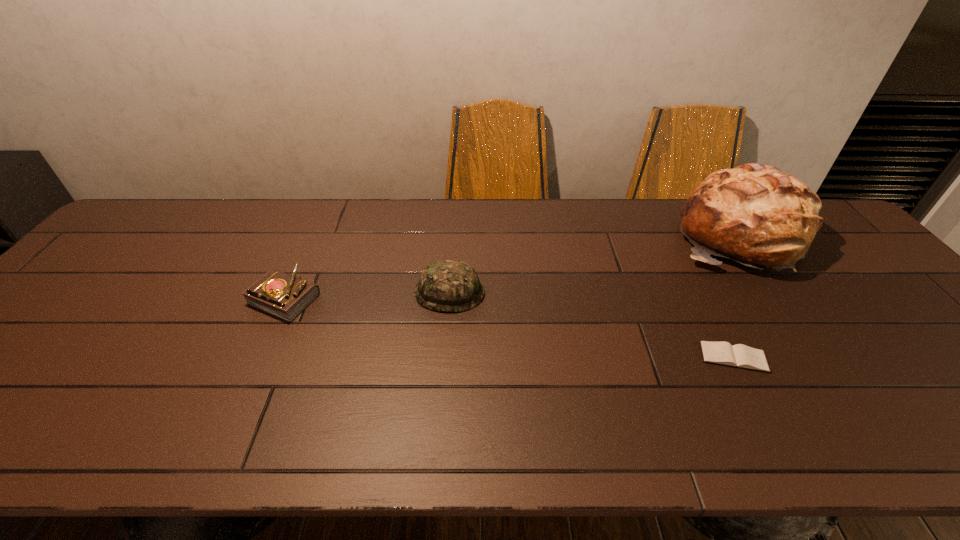
Locate an element on the screen. Image resolution: width=960 pixels, height=540 pixels. free space located on the back of the right diary is located at coordinates (696, 284).

At what (x,y) coordinates should I click in order to perform the action: click on object present at the far edge. Please return your answer as a coordinate pair (x, y). Looking at the image, I should click on pos(755,214).

Where is `object that is at the right edge`? This screenshot has width=960, height=540. object that is at the right edge is located at coordinates (755, 214).

Identify the location of object situated at the far right corner. The height and width of the screenshot is (540, 960). (755, 214).

Locate an element on the screen. free space at the far edge is located at coordinates (559, 209).

Locate an element on the screen. free space at the near edge of the desktop is located at coordinates (679, 415).

I want to click on free region at the left edge of the desktop, so click(x=108, y=287).

This screenshot has height=540, width=960. I want to click on vacant space at the right edge of the desktop, so click(908, 333).

At what (x,y) coordinates should I click in order to perform the action: click on empty space that is in between the third shortest object and the shorter diary. Please return your answer as a coordinate pair (x, y). The height and width of the screenshot is (540, 960). Looking at the image, I should click on (591, 325).

What are the coordinates of `vacant point located between the tallest object and the nearest object` in the screenshot? It's located at (735, 297).